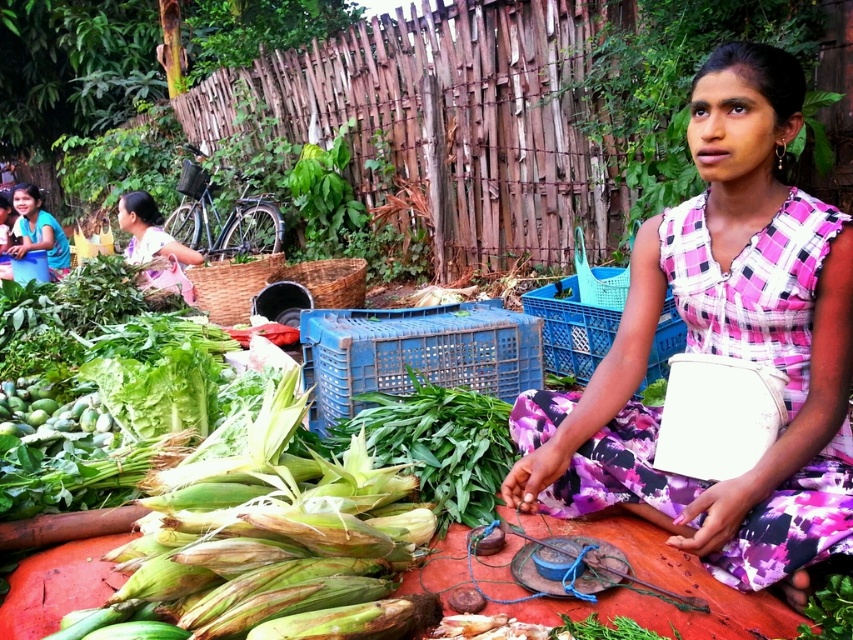
Is point (242, 506) in front of point (186, 292)?

Yes, point (242, 506) is closer to viewer.

Between point (369, 464) and point (157, 275), which one is positioned in front?

Point (369, 464) is in front.

Find the location of `green rough corn at lower left`. green rough corn at lower left is located at coordinates (271, 538).

Is the position of green rough corn at lower left more distant than that of green leafy vegetable at center?

No, it is not.

Does green rough corn at lower left appear under green leafy vegetable at center?

Correct, green rough corn at lower left is located below green leafy vegetable at center.

Between point (283, 467) and point (431, 477), which one is positioned behind?

The point (431, 477) is more distant.

The width and height of the screenshot is (853, 640). I want to click on green rough corn at lower left, so click(x=271, y=538).

Between point (415, 468) and point (22, 256), which one is positioned behind?

Point (22, 256)

Measure the distance between green leafy vegetable at center and matte blue bucket at upper left.

4.29 meters

Locate an element on the screen. green leafy vegetable at center is located at coordinates (437, 444).